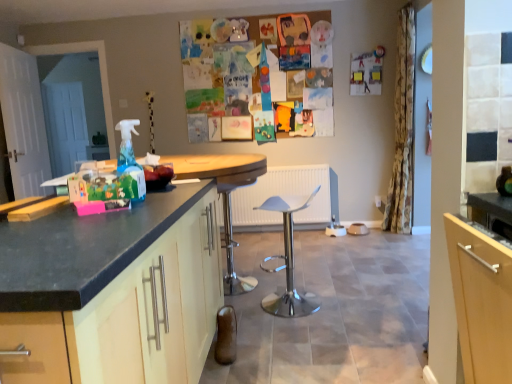
What are the coordinates of `vacant space in white glossy swivel chair at center (from a real-world perspective)` in the screenshot? It's located at (293, 306).